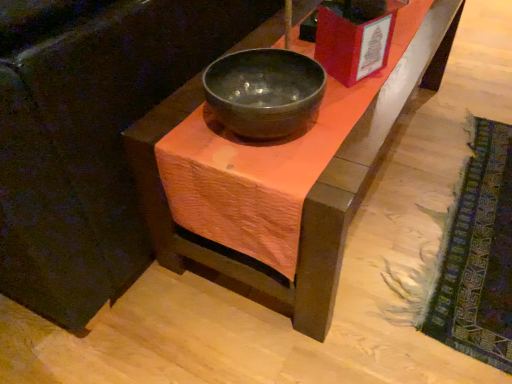
At what (x,y) coordinates should I click in order to perform the action: click on unoccupied region to the right of matte black bowl at center. Please return your answer as a coordinate pair (x, y). This screenshot has height=384, width=512. Looking at the image, I should click on (355, 119).